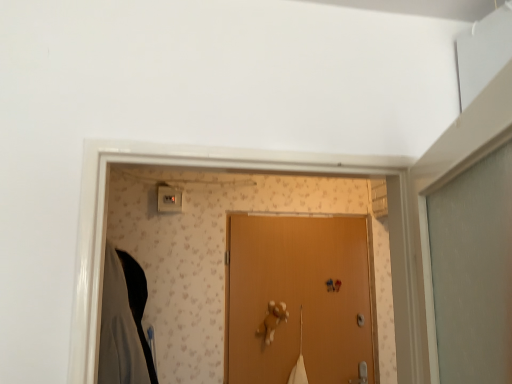
Question: Considering the relative sizes of wooden door at center and black matte robe at left in the image provided, is wooden door at center taller than black matte robe at left?

Choices:
 (A) no
 (B) yes

Answer: (B)

Question: Is wooden door at center positioned behind black matte robe at left?

Choices:
 (A) yes
 (B) no

Answer: (A)

Question: Does wooden door at center come in front of black matte robe at left?

Choices:
 (A) yes
 (B) no

Answer: (B)

Question: Considering the relative positions of wooden door at center and black matte robe at left in the image provided, is wooden door at center to the left of black matte robe at left from the viewer's perspective?

Choices:
 (A) no
 (B) yes

Answer: (A)

Question: From the image's perspective, does wooden door at center appear lower than black matte robe at left?

Choices:
 (A) no
 (B) yes

Answer: (B)

Question: Does point (111, 360) appear closer or farther from the camera than point (168, 208)?

Choices:
 (A) closer
 (B) farther

Answer: (A)

Question: In terms of height, does black matte robe at left look taller or shorter compared to white plastic light switch at upper center?

Choices:
 (A) short
 (B) tall

Answer: (B)

Question: From a real-world perspective, is black matte robe at left physically located above or below white plastic light switch at upper center?

Choices:
 (A) below
 (B) above

Answer: (A)

Question: Considering the positions of black matte robe at left and white plastic light switch at upper center in the image, is black matte robe at left bigger or smaller than white plastic light switch at upper center?

Choices:
 (A) small
 (B) big

Answer: (B)

Question: From their relative heights in the image, would you say wooden door at center is taller or shorter than white plastic light switch at upper center?

Choices:
 (A) tall
 (B) short

Answer: (A)

Question: From the image's perspective, is wooden door at center located above or below white plastic light switch at upper center?

Choices:
 (A) below
 (B) above

Answer: (A)

Question: Considering the positions of wooden door at center and white plastic light switch at upper center in the image, is wooden door at center bigger or smaller than white plastic light switch at upper center?

Choices:
 (A) small
 (B) big

Answer: (B)

Question: Is wooden door at center in front of or behind white plastic light switch at upper center in the image?

Choices:
 (A) behind
 (B) front

Answer: (B)

Question: Is white plastic light switch at upper center wider or thinner than black matte robe at left?

Choices:
 (A) wide
 (B) thin

Answer: (B)

Question: From the image's perspective, is white plastic light switch at upper center above or below black matte robe at left?

Choices:
 (A) below
 (B) above

Answer: (B)